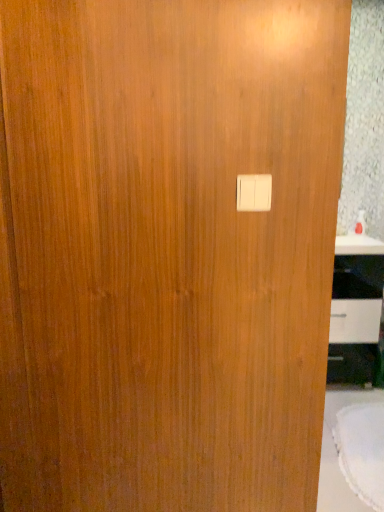
Question: Is white fabric table at lower right bigger than white plastic light switch at center?

Choices:
 (A) no
 (B) yes

Answer: (B)

Question: Can you confirm if white fabric table at lower right is wider than white plastic light switch at center?

Choices:
 (A) yes
 (B) no

Answer: (A)

Question: Can you confirm if white fabric table at lower right is smaller than white plastic light switch at center?

Choices:
 (A) yes
 (B) no

Answer: (B)

Question: From a real-world perspective, does white fabric table at lower right stand above white plastic light switch at center?

Choices:
 (A) yes
 (B) no

Answer: (B)

Question: Does white fabric table at lower right have a lesser width compared to white plastic light switch at center?

Choices:
 (A) no
 (B) yes

Answer: (A)

Question: In terms of width, does white fabric table at lower right look wider or thinner when compared to white glossy cabinet at right?

Choices:
 (A) thin
 (B) wide

Answer: (B)

Question: Visually, is white fabric table at lower right positioned to the left or to the right of white glossy cabinet at right?

Choices:
 (A) left
 (B) right

Answer: (A)

Question: Looking at the image, does white fabric table at lower right seem bigger or smaller compared to white glossy cabinet at right?

Choices:
 (A) small
 (B) big

Answer: (A)

Question: Does point (337, 436) appear closer or farther from the camera than point (354, 284)?

Choices:
 (A) farther
 (B) closer

Answer: (B)

Question: Is white fabric table at lower right in front of or behind white plastic light switch at center in the image?

Choices:
 (A) front
 (B) behind

Answer: (B)

Question: Considering the positions of white fabric table at lower right and white plastic light switch at center in the image, is white fabric table at lower right wider or thinner than white plastic light switch at center?

Choices:
 (A) thin
 (B) wide

Answer: (B)

Question: Is white fabric table at lower right taller or shorter than white plastic light switch at center?

Choices:
 (A) short
 (B) tall

Answer: (A)

Question: Based on their positions, is white fabric table at lower right located to the left or right of white plastic light switch at center?

Choices:
 (A) right
 (B) left

Answer: (A)

Question: Considering their positions, is white glossy cabinet at right located in front of or behind white fabric table at lower right?

Choices:
 (A) front
 (B) behind

Answer: (B)

Question: From the image's perspective, is white glossy cabinet at right positioned above or below white fabric table at lower right?

Choices:
 (A) above
 (B) below

Answer: (A)